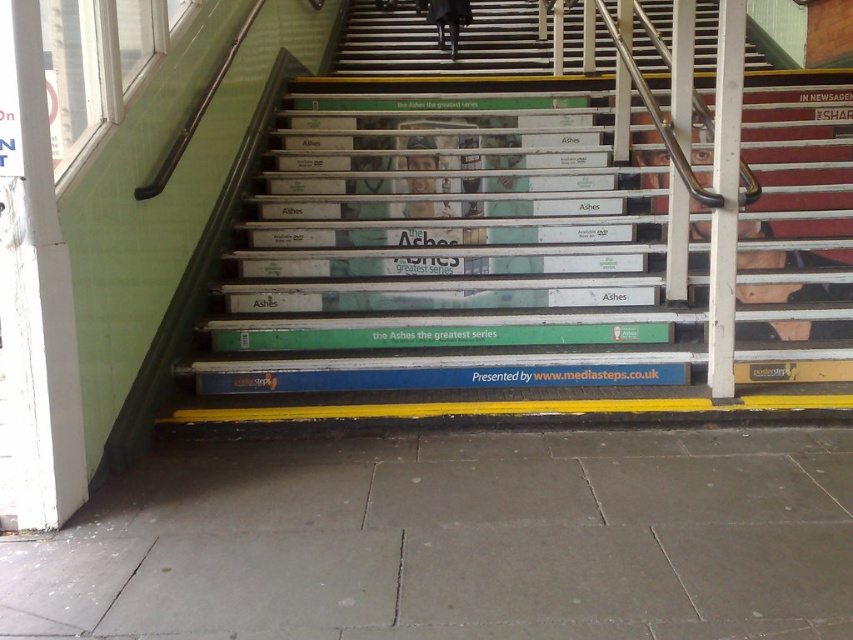
Question: Does white painted wood stairs at upper center appear under dark clothing at center?

Choices:
 (A) no
 (B) yes

Answer: (A)

Question: Which point is farther from the camera taking this photo?

Choices:
 (A) (442, 45)
 (B) (550, 40)

Answer: (B)

Question: Is white painted wood stairs at upper center further to the viewer compared to dark clothing at center?

Choices:
 (A) yes
 (B) no

Answer: (B)

Question: Is white painted wood stairs at upper center further to the viewer compared to dark clothing at center?

Choices:
 (A) yes
 (B) no

Answer: (B)